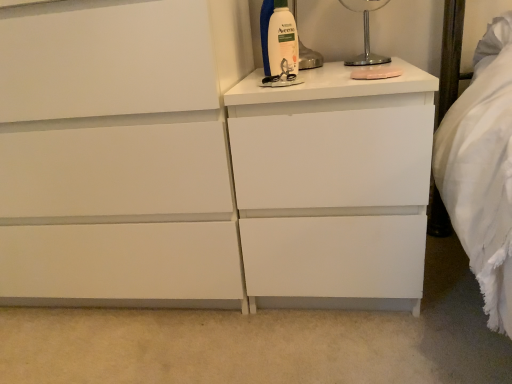
Question: Is white matte chest of drawers at center behind metallic silver lamp at upper right?

Choices:
 (A) yes
 (B) no

Answer: (B)

Question: Is white matte chest of drawers at center surrounding metallic silver lamp at upper right?

Choices:
 (A) yes
 (B) no

Answer: (B)

Question: Is white matte chest of drawers at center oriented away from metallic silver lamp at upper right?

Choices:
 (A) yes
 (B) no

Answer: (B)

Question: From a real-world perspective, is white matte chest of drawers at center located beneath metallic silver lamp at upper right?

Choices:
 (A) yes
 (B) no

Answer: (A)

Question: Can you confirm if white matte chest of drawers at center is positioned to the right of metallic silver lamp at upper right?

Choices:
 (A) no
 (B) yes

Answer: (A)

Question: Looking at their shapes, would you say white matte nightstand at center is wider or thinner than metallic silver lamp at upper right?

Choices:
 (A) thin
 (B) wide

Answer: (B)

Question: Is point (330, 274) closer or farther from the camera than point (354, 3)?

Choices:
 (A) closer
 (B) farther

Answer: (A)

Question: In the image, is white matte nightstand at center positioned in front of or behind metallic silver lamp at upper right?

Choices:
 (A) behind
 (B) front

Answer: (B)

Question: From the image's perspective, is white matte nightstand at center located above or below metallic silver lamp at upper right?

Choices:
 (A) above
 (B) below

Answer: (B)

Question: From a real-world perspective, relative to metallic silver lamp at upper right, is white plastic bottle at upper right vertically above or below?

Choices:
 (A) above
 (B) below

Answer: (B)

Question: Considering the relative positions of white plastic bottle at upper right and metallic silver lamp at upper right in the image provided, is white plastic bottle at upper right to the left or to the right of metallic silver lamp at upper right?

Choices:
 (A) right
 (B) left

Answer: (B)

Question: Relative to metallic silver lamp at upper right, is white plastic bottle at upper right in front or behind?

Choices:
 (A) front
 (B) behind

Answer: (A)

Question: Considering the positions of white plastic bottle at upper right and metallic silver lamp at upper right in the image, is white plastic bottle at upper right bigger or smaller than metallic silver lamp at upper right?

Choices:
 (A) small
 (B) big

Answer: (A)

Question: Does point (55, 261) appear closer or farther from the camera than point (293, 51)?

Choices:
 (A) closer
 (B) farther

Answer: (B)

Question: From a real-world perspective, relative to white plastic bottle at upper right, is white matte chest of drawers at center vertically above or below?

Choices:
 (A) above
 (B) below

Answer: (B)